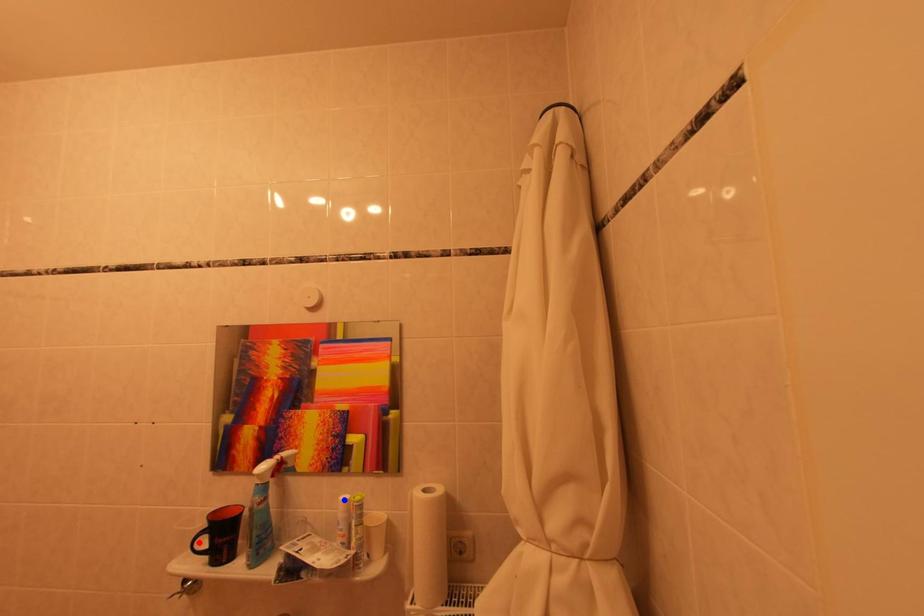
Question: Two points are marked on the image. Which point is closer to the camera?

Choices:
 (A) Blue point is closer.
 (B) Red point is closer.

Answer: (B)